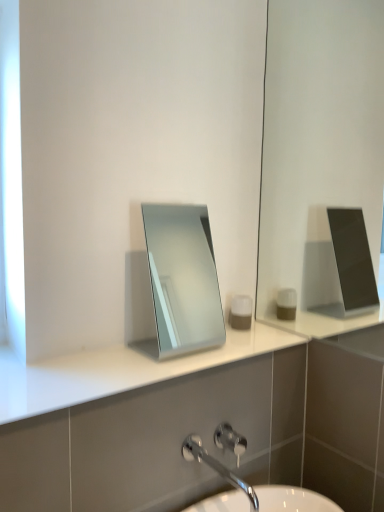
Question: From a real-world perspective, is brushed metal shower at lower center physically below chrome metallic faucet at lower center?

Choices:
 (A) yes
 (B) no

Answer: (A)

Question: Does brushed metal shower at lower center have a greater height compared to chrome metallic faucet at lower center?

Choices:
 (A) yes
 (B) no

Answer: (A)

Question: Is brushed metal shower at lower center outside of chrome metallic faucet at lower center?

Choices:
 (A) no
 (B) yes

Answer: (B)

Question: From the image's perspective, is brushed metal shower at lower center beneath chrome metallic faucet at lower center?

Choices:
 (A) yes
 (B) no

Answer: (B)

Question: From the image's perspective, is brushed metal shower at lower center on top of chrome metallic faucet at lower center?

Choices:
 (A) no
 (B) yes

Answer: (B)

Question: Is matte gray container at center inside the boundaries of white glossy counter top at center, or outside?

Choices:
 (A) outside
 (B) inside

Answer: (A)

Question: From a real-world perspective, is matte gray container at center above or below white glossy counter top at center?

Choices:
 (A) below
 (B) above

Answer: (B)

Question: Is matte gray container at center taller or shorter than white glossy counter top at center?

Choices:
 (A) tall
 (B) short

Answer: (A)

Question: Is point (238, 308) closer or farther from the camera than point (86, 364)?

Choices:
 (A) closer
 (B) farther

Answer: (B)

Question: Does point (201, 336) appear closer or farther from the camera than point (13, 404)?

Choices:
 (A) farther
 (B) closer

Answer: (A)

Question: Is silver metallic mirror at center taller or shorter than white glossy counter top at center?

Choices:
 (A) tall
 (B) short

Answer: (A)

Question: Considering the positions of silver metallic mirror at center and white glossy counter top at center in the image, is silver metallic mirror at center bigger or smaller than white glossy counter top at center?

Choices:
 (A) big
 (B) small

Answer: (A)

Question: From the image's perspective, is silver metallic mirror at center above or below white glossy counter top at center?

Choices:
 (A) below
 (B) above

Answer: (B)

Question: In the image, is brushed metal shower at lower center on the left side or the right side of matte gray container at center?

Choices:
 (A) left
 (B) right

Answer: (A)

Question: From the image's perspective, relative to matte gray container at center, is brushed metal shower at lower center above or below?

Choices:
 (A) above
 (B) below

Answer: (B)